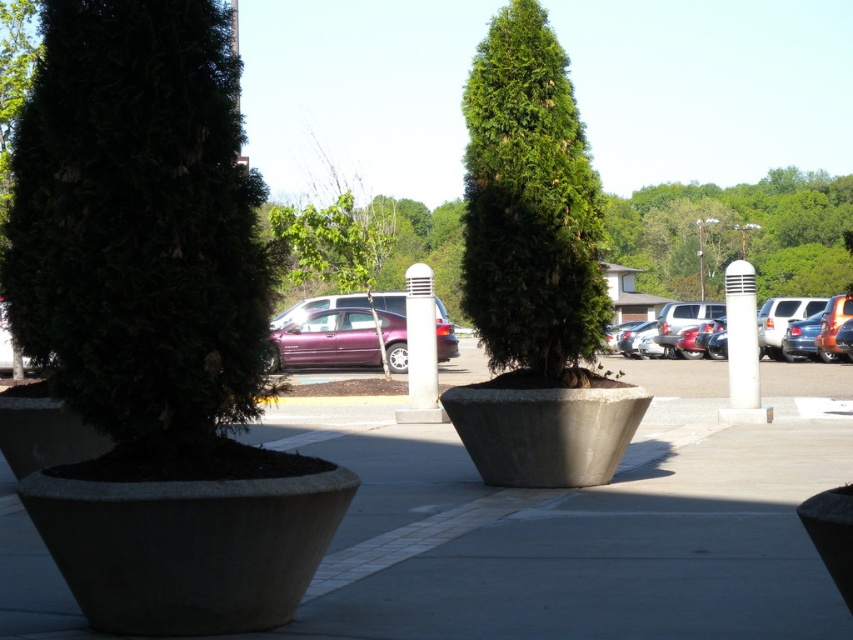
You are standing at the center of the parking lot and see two points marked in the image. Which point, point (241, 214) or point (791, 308), is closer to you?

Point (241, 214) is closer to you because it is in front of point (791, 308).

You are a delivery person trying to park your van that is 2 meters wide. You see the green matte tree at left and the metallic purple sedan at center. Which object has a smaller width, and can you safely park your van between them without hitting either?

The green matte tree at left has a smaller width compared to the metallic purple sedan at center. Since the tree is narrower, you can park your van between them as long as you position it away from the wider sedan to avoid collision.

You are a delivery person trying to park your 1.8 meters tall delivery cart in this parking lot. You see the green matte tree at left and the metallic silver sedan at center right. Can your cart fit vertically between them without hitting the tree or the car?

The green matte tree at left is taller than the metallic silver sedan at center right. Since your cart is only 1.8 meters tall, it should fit vertically between them as long as you position it below the tree and avoid the car.